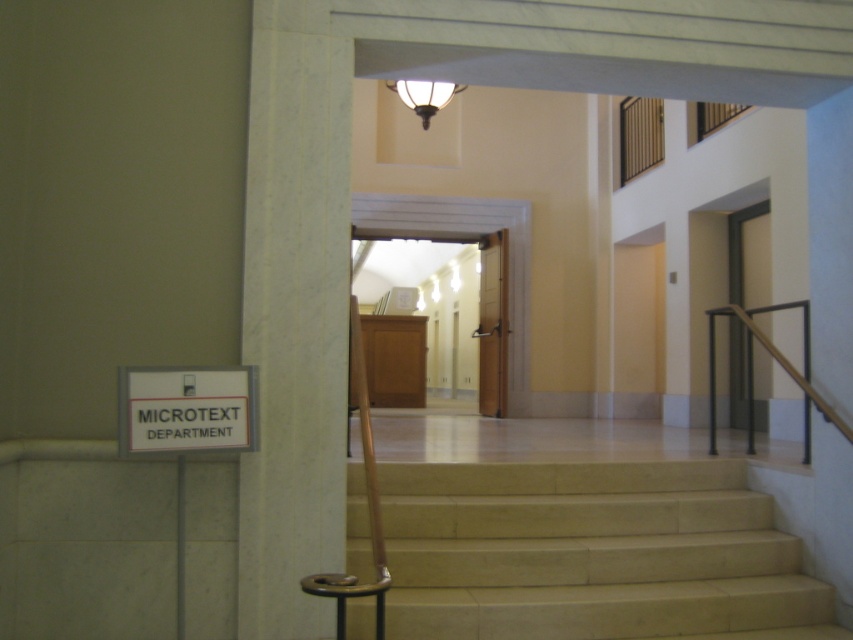
Question: Estimate the real-world distances between objects in this image. Which object is farther from the black metal railing at right?

Choices:
 (A) beige marble stairs at center
 (B) white marble pillar at left

Answer: (B)

Question: Which of these objects is positioned farthest from the white plastic sign at lower left?

Choices:
 (A) black metal railing at right
 (B) beige marble stairs at center
 (C) white marble pillar at left

Answer: (A)

Question: From the image, what is the correct spatial relationship of white plastic sign at lower left in relation to black metal railing at right?

Choices:
 (A) above
 (B) below

Answer: (A)

Question: Considering the relative positions of white plastic sign at lower left and black metal railing at right in the image provided, where is white plastic sign at lower left located with respect to black metal railing at right?

Choices:
 (A) below
 (B) above

Answer: (B)

Question: Which point is closer to the camera?

Choices:
 (A) white plastic sign at lower left
 (B) black metal railing at right

Answer: (A)

Question: Is beige marble stairs at center above white plastic sign at lower left?

Choices:
 (A) no
 (B) yes

Answer: (A)